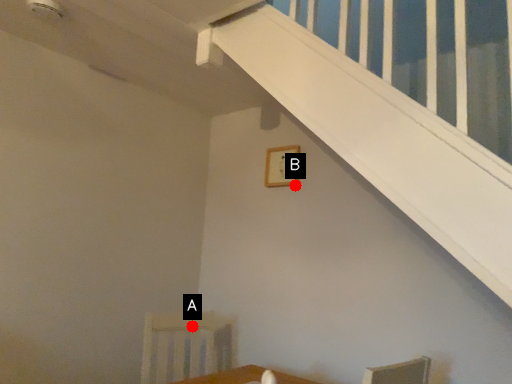
Question: Two points are circled on the image, labeled by A and B beside each circle. Which point is closer to the camera?

Choices:
 (A) A is closer
 (B) B is closer

Answer: (A)